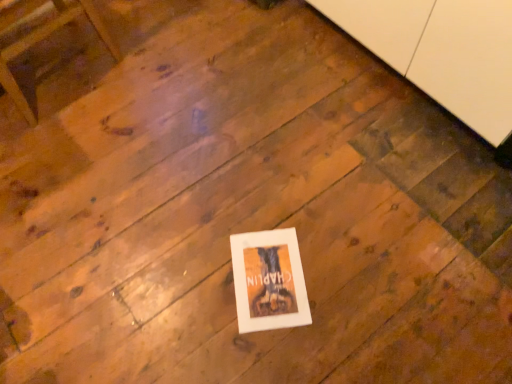
Image resolution: width=512 pixels, height=384 pixels. What do you see at coordinates (42, 39) in the screenshot?
I see `wooden chair at upper left` at bounding box center [42, 39].

Where is `white paper at center`? This screenshot has height=384, width=512. white paper at center is located at coordinates (269, 281).

Describe the element at coordinates (442, 52) in the screenshot. I see `white matte cabinet at upper right` at that location.

Where is `wooden chair at upper left`? wooden chair at upper left is located at coordinates point(42,39).

Is white matte cabinet at upper right with wooden chair at upper left?

No, white matte cabinet at upper right is not next to wooden chair at upper left.

Which object is further away from the camera, white matte cabinet at upper right or wooden chair at upper left?

wooden chair at upper left is further from the camera.

How many degrees apart are the facing directions of white matte cabinet at upper right and wooden chair at upper left?

6.98 degrees.

Find the location of a particular element. The height and width of the screenshot is (384, 512). furniture located in front of the white paper at center is located at coordinates (42, 39).

What's the angular difference between wooden chair at upper left and white paper at center's facing directions?

The angle between the facing direction of wooden chair at upper left and the facing direction of white paper at center is 38.7 degrees.

Is wooden chair at upper left not near white paper at center?

Yes, wooden chair at upper left and white paper at center are located far from each other.

Does wooden chair at upper left have a lesser height compared to white paper at center?

No, wooden chair at upper left is not shorter than white paper at center.

From their relative heights in the image, would you say wooden chair at upper left is taller or shorter than white matte cabinet at upper right?

Clearly, wooden chair at upper left is shorter compared to white matte cabinet at upper right.

Is there a large distance between wooden chair at upper left and white matte cabinet at upper right?

Yes, wooden chair at upper left and white matte cabinet at upper right are located far from each other.

Is wooden chair at upper left inside the boundaries of white matte cabinet at upper right, or outside?

The correct answer is: outside.

The image size is (512, 384). I want to click on furniture below the white matte cabinet at upper right (from a real-world perspective), so click(42, 39).

Is white paper at center facing towards white matte cabinet at upper right?

No, white paper at center is not aimed at white matte cabinet at upper right.

Is white paper at center positioned behind white matte cabinet at upper right?

Yes, white paper at center is behind white matte cabinet at upper right.

Is white paper at center taller than white matte cabinet at upper right?

In fact, white paper at center may be shorter than white matte cabinet at upper right.

Does point (351, 29) come behind point (252, 320)?

Yes, point (351, 29) is farther from viewer.

Do you think white matte cabinet at upper right is within white paper at center, or outside of it?

white matte cabinet at upper right is outside white paper at center.

I want to click on cabinetry above the white paper at center (from the image's perspective), so click(442, 52).

Is white paper at center turned away from wooden chair at upper left?

white paper at center does not have its back to wooden chair at upper left.

How different are the orientations of white paper at center and wooden chair at upper left in degrees?

There is a 38.7-degree angle between the facing directions of white paper at center and wooden chair at upper left.

From the image's perspective, which object appears higher, white paper at center or wooden chair at upper left?

From the image's view, wooden chair at upper left is above.

I want to click on furniture in front of the white paper at center, so click(42, 39).

This screenshot has width=512, height=384. Find the location of `furniture located below the white matte cabinet at upper right (from the image's perspective)`. furniture located below the white matte cabinet at upper right (from the image's perspective) is located at coordinates (42, 39).

Image resolution: width=512 pixels, height=384 pixels. What are the coordinates of `furniture lying above the white paper at center (from the image's perspective)` in the screenshot? It's located at (42, 39).

Looking at the image, which one is located closer to white paper at center, white matte cabinet at upper right or wooden chair at upper left?

white matte cabinet at upper right.

Which object lies further to the anchor point wooden chair at upper left, white matte cabinet at upper right or white paper at center?

white matte cabinet at upper right lies further to wooden chair at upper left than the other object.

Estimate the real-world distances between objects in this image. Which object is closer to white paper at center, wooden chair at upper left or white matte cabinet at upper right?

white matte cabinet at upper right is positioned closer to the anchor white paper at center.

From the image, which object appears to be farther from white matte cabinet at upper right, white paper at center or wooden chair at upper left?

wooden chair at upper left.

When comparing their distances from white matte cabinet at upper right, does wooden chair at upper left or white paper at center seem further?

wooden chair at upper left is further to white matte cabinet at upper right.

Considering their positions, is white paper at center positioned closer to wooden chair at upper left than white matte cabinet at upper right?

white paper at center is positioned closer to the anchor wooden chair at upper left.

Image resolution: width=512 pixels, height=384 pixels. What are the coordinates of `picture frame between wooden chair at upper left and white matte cabinet at upper right in the horizontal direction` in the screenshot? It's located at (269, 281).